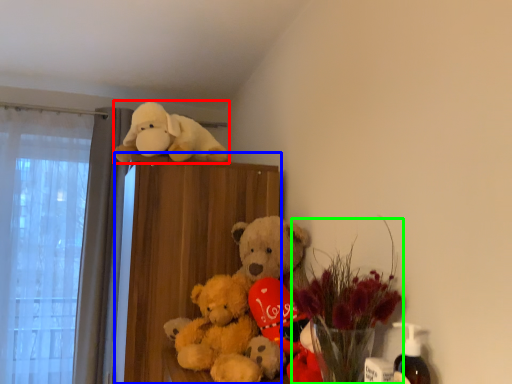
Question: Which object is the closest to the toy (highlighted by a red box)? Choose among these: bookshelf (highlighted by a blue box) or floral arrangement (highlighted by a green box).

Choices:
 (A) bookshelf
 (B) floral arrangement

Answer: (A)